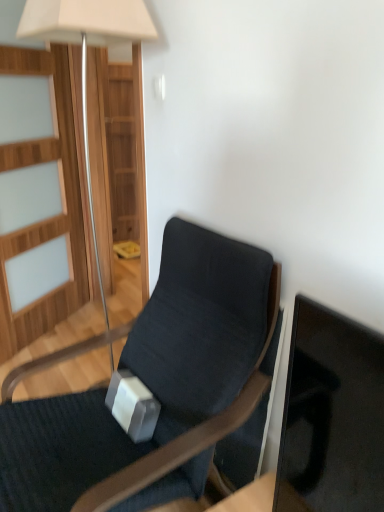
Question: Is dark fabric chair at center to the right of matte white lamp at upper left from the viewer's perspective?

Choices:
 (A) yes
 (B) no

Answer: (A)

Question: Is dark fabric chair at center next to matte white lamp at upper left and touching it?

Choices:
 (A) yes
 (B) no

Answer: (B)

Question: Can you confirm if dark fabric chair at center is wider than matte white lamp at upper left?

Choices:
 (A) no
 (B) yes

Answer: (B)

Question: Considering the relative sizes of dark fabric chair at center and matte white lamp at upper left in the image provided, is dark fabric chair at center shorter than matte white lamp at upper left?

Choices:
 (A) no
 (B) yes

Answer: (B)

Question: Is dark fabric chair at center facing away from matte white lamp at upper left?

Choices:
 (A) no
 (B) yes

Answer: (A)

Question: From a real-world perspective, is dark fabric chair at center located beneath matte white lamp at upper left?

Choices:
 (A) no
 (B) yes

Answer: (B)

Question: Is dark fabric chair at center located within matte white lamp at upper left?

Choices:
 (A) yes
 (B) no

Answer: (B)

Question: From a real-world perspective, is matte white lamp at upper left physically above dark fabric chair at center?

Choices:
 (A) no
 (B) yes

Answer: (B)

Question: Is matte white lamp at upper left shorter than dark fabric chair at center?

Choices:
 (A) yes
 (B) no

Answer: (B)

Question: From a real-world perspective, is matte white lamp at upper left under dark fabric chair at center?

Choices:
 (A) no
 (B) yes

Answer: (A)

Question: Can you confirm if matte white lamp at upper left is thinner than dark fabric chair at center?

Choices:
 (A) no
 (B) yes

Answer: (B)

Question: Would you consider matte white lamp at upper left to be distant from dark fabric chair at center?

Choices:
 (A) no
 (B) yes

Answer: (B)

Question: From the image's perspective, is matte white lamp at upper left above or below dark fabric chair at center?

Choices:
 (A) above
 (B) below

Answer: (A)